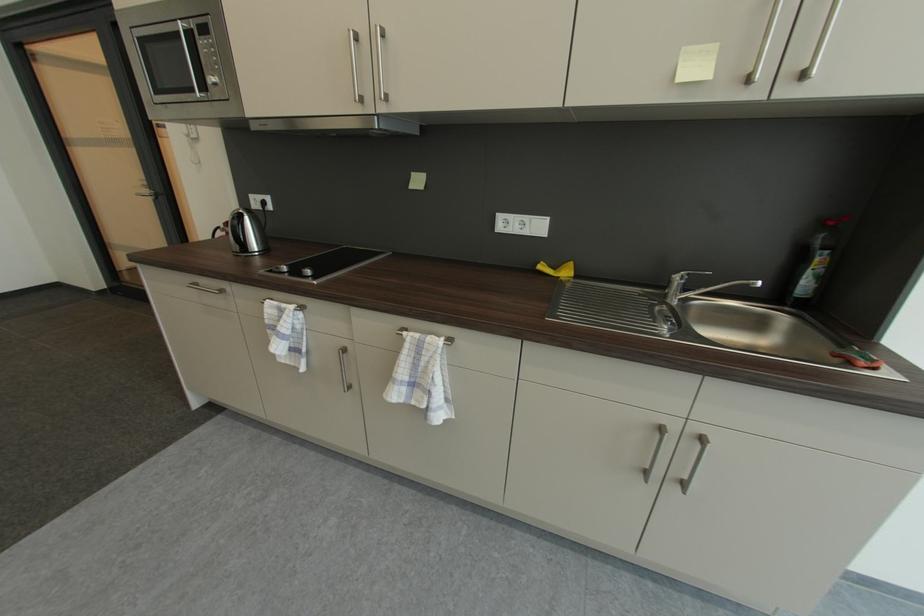
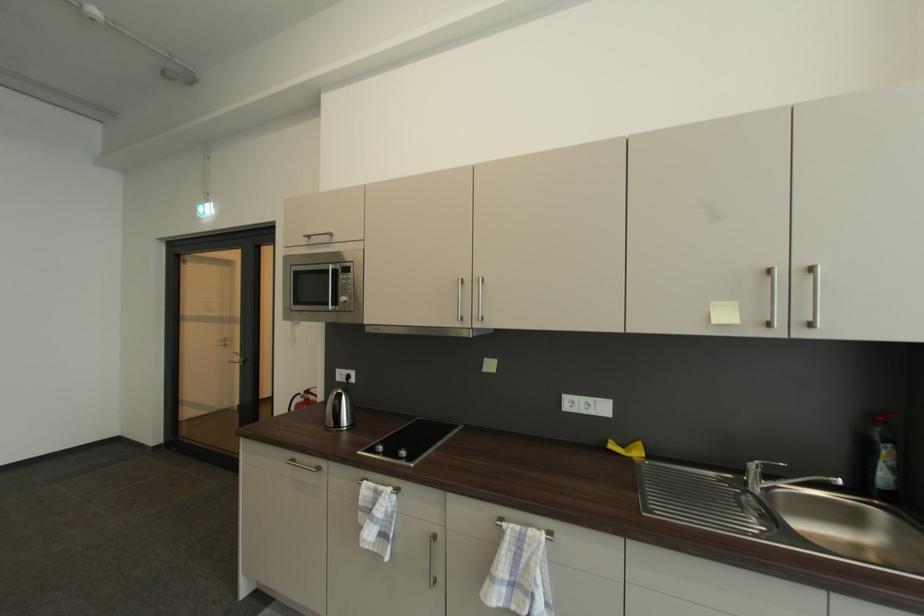
Where in the second image is the point corresponding to (407,337) from the first image?

(507, 529)